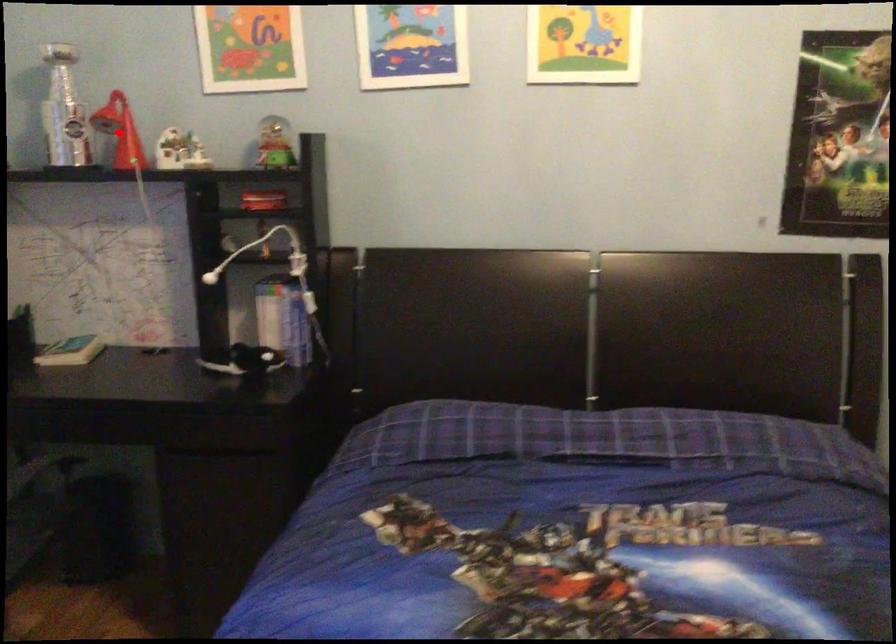
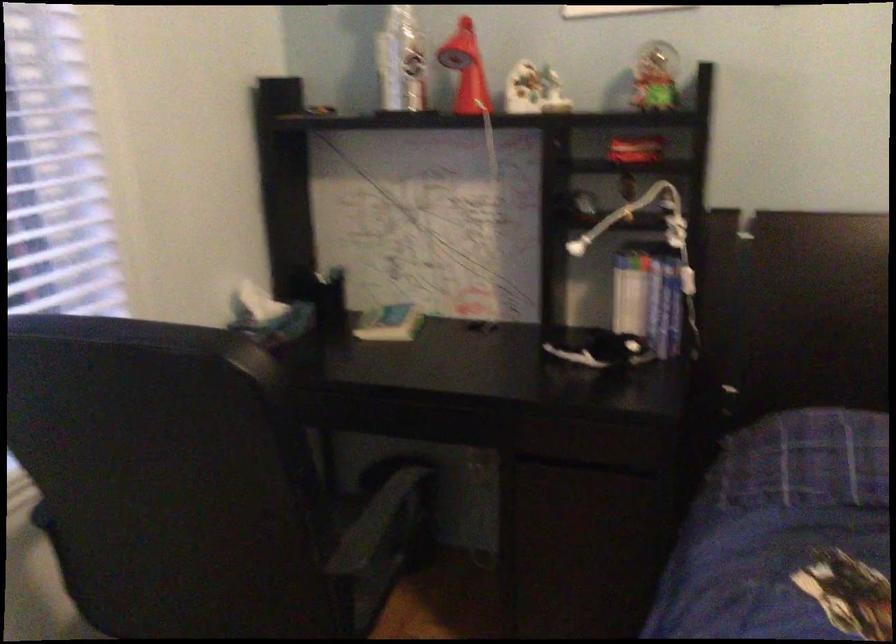
Find the pixel in the second image that matches the highlighted location in the first image.

(466, 69)